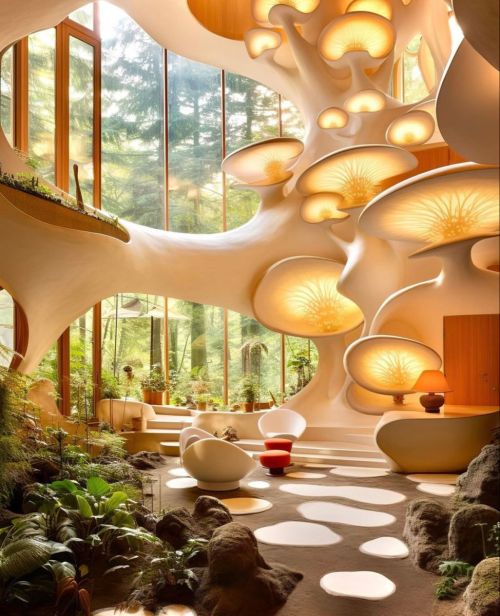
You are a GUI agent. You are given a task and a screenshot of the screen. Output one action in this format:
    pyautogui.click(x=<x>, y=<y>)
    Task: Click on the stairway
    This screenshot has height=616, width=500.
    Given the screenshot: What is the action you would take?
    pyautogui.click(x=352, y=444)